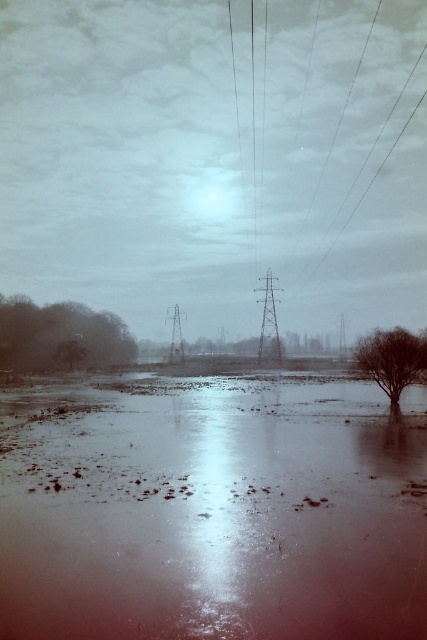
Question: Is metallic wires at upper right bigger than green matte tree at lower left?

Choices:
 (A) yes
 (B) no

Answer: (A)

Question: Which point is farther from the camera taking this photo?

Choices:
 (A) (96, 333)
 (B) (424, 380)
 (C) (237, 163)
 (D) (158, 522)

Answer: (C)

Question: Among these points, which one is farthest from the camera?

Choices:
 (A) (391, 358)
 (B) (64, 310)
 (C) (301, 568)
 (D) (227, 8)

Answer: (D)

Question: Can you confirm if metallic wires at upper right is positioned to the left of green matte tree at lower left?

Choices:
 (A) no
 (B) yes

Answer: (A)

Question: Which point is farther from the camera taking this photo?

Choices:
 (A) tap(81, 320)
 (B) tap(414, 344)

Answer: (A)

Question: Can you confirm if metallic wires at upper right is positioned to the left of bare brown tree at right?

Choices:
 (A) yes
 (B) no

Answer: (B)